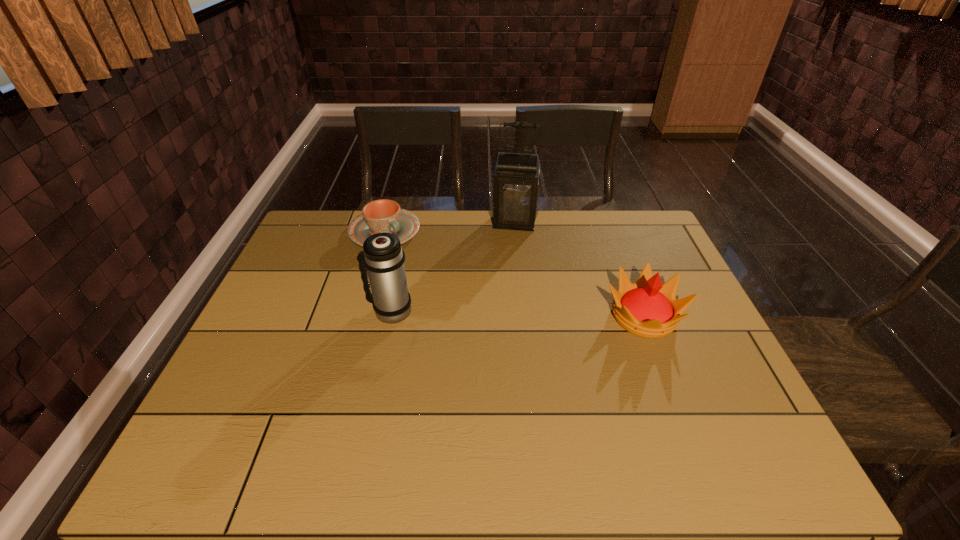
Find the location of `vacant space located on the front-facing side of the tallest object`. vacant space located on the front-facing side of the tallest object is located at coordinates (503, 311).

Find the location of a particular element. Image resolution: width=960 pixels, height=540 pixels. free space located on the front-facing side of the tallest object is located at coordinates (510, 255).

Locate an element on the screen. free space located 0.240m on the front-facing side of the tallest object is located at coordinates (507, 280).

Locate an element on the screen. free region located 0.280m on the handle side of the shortest object is located at coordinates (461, 293).

Image resolution: width=960 pixels, height=540 pixels. What are the coordinates of `vacant space located on the handle side of the shortest object` in the screenshot? It's located at (445, 280).

Locate an element on the screen. The height and width of the screenshot is (540, 960). free spot located on the handle side of the shortest object is located at coordinates (474, 303).

Locate an element on the screen. The height and width of the screenshot is (540, 960). lantern that is at the far edge is located at coordinates (516, 185).

Locate an element on the screen. chinaware at the far edge is located at coordinates (380, 216).

You are a GUI agent. You are given a task and a screenshot of the screen. Output one action in this format:
    pyautogui.click(x=<x>, y=<y>)
    Task: Click on the object that is positioned at the left edge
    
    Given the screenshot: What is the action you would take?
    pyautogui.click(x=380, y=216)

Where is `object that is positioned at the right edge`? The image size is (960, 540). object that is positioned at the right edge is located at coordinates (647, 308).